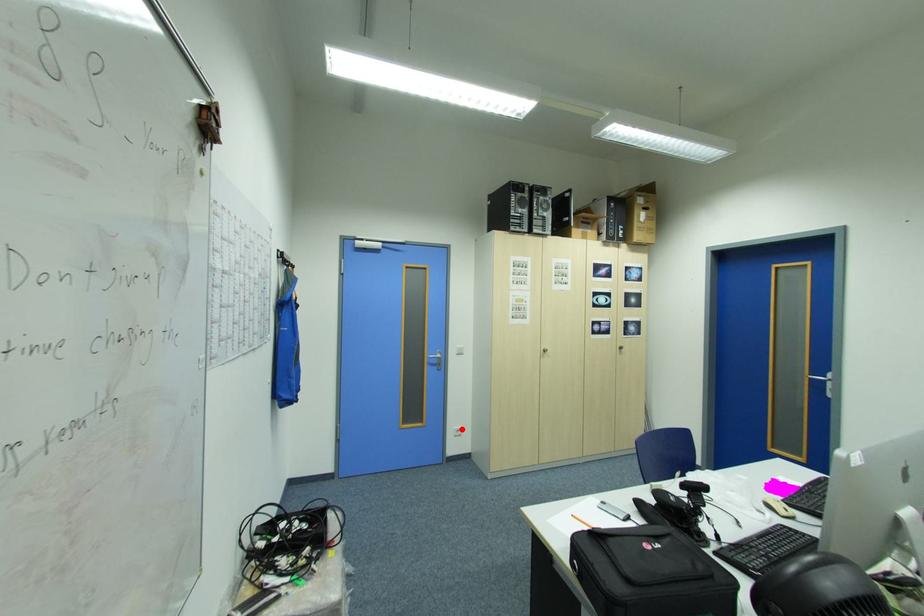
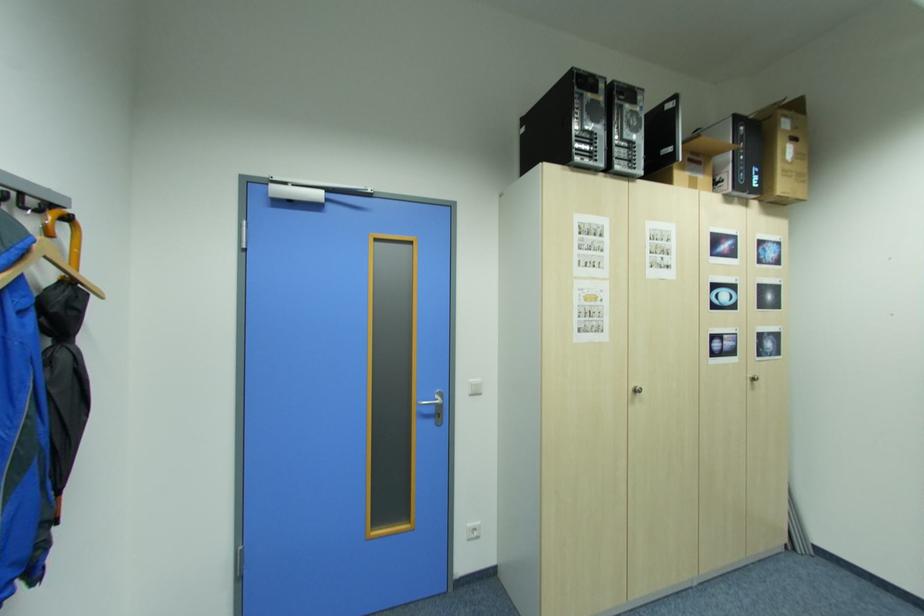
Question: I am providing you with two images of the same scene from different viewpoints. In image1, a red point is highlighted. Considering the same 3D point in image2, which of the following is correct?

Choices:
 (A) It is closer
 (B) It is farther

Answer: (A)